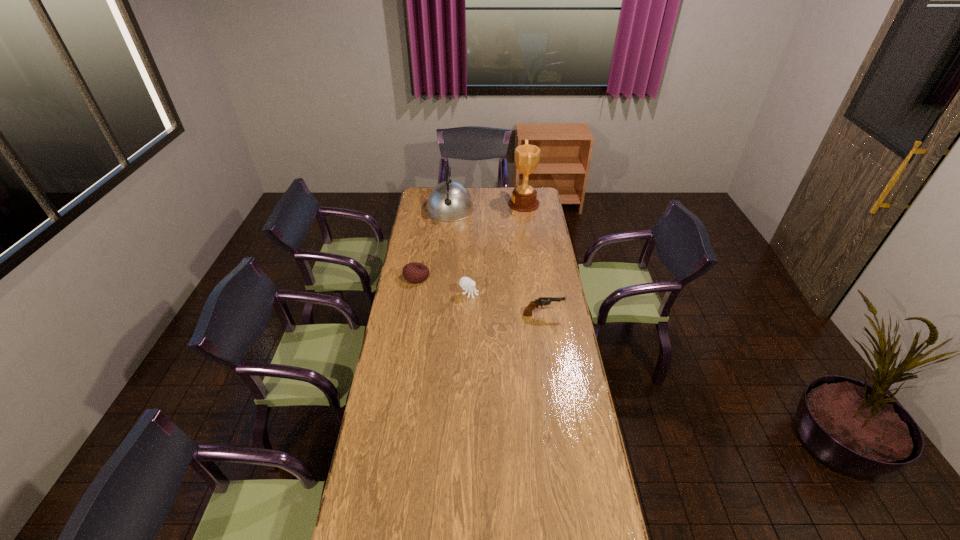
Where is `the tallest object`? the tallest object is located at coordinates (524, 197).

This screenshot has height=540, width=960. Identify the location of the fourth shortest object. (449, 201).

You are a GUI agent. You are given a task and a screenshot of the screen. Output one action in this format:
    pyautogui.click(x=<x>, y=<y>)
    Task: Click on the gun
    
    Given the screenshot: What is the action you would take?
    pyautogui.click(x=542, y=301)

Locate an element on the screen. The width and height of the screenshot is (960, 540). octopus is located at coordinates click(465, 282).

Identify the location of the third nearest object. This screenshot has width=960, height=540. (414, 272).

The width and height of the screenshot is (960, 540). Identify the location of the shortest object. coord(414,272).

At what (x,y) coordinates should I click in order to perform the action: click on vacant position located on the front-facing side of the tallest object. Please return your answer as a coordinate pair (x, y). Image resolution: width=960 pixels, height=540 pixels. Looking at the image, I should click on (482, 204).

Where is `vacant space located 0.320m on the front-facing side of the tallest object`? The image size is (960, 540). vacant space located 0.320m on the front-facing side of the tallest object is located at coordinates (459, 204).

You are a GUI agent. You are given a task and a screenshot of the screen. Output one action in this format:
    pyautogui.click(x=<x>, y=<y>)
    Task: Click on the free location located on the front-facing side of the tallest object
    This screenshot has width=960, height=540.
    Given the screenshot: What is the action you would take?
    pyautogui.click(x=454, y=204)

Locate an element on the screen. Image resolution: width=960 pixels, height=540 pixels. blank space located from the spout of the second tallest object is located at coordinates (448, 228).